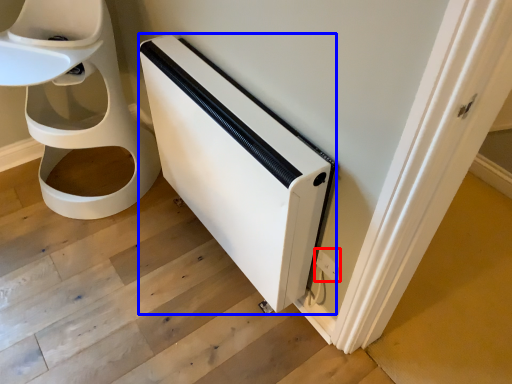
Question: Which of the following is the closest to the observer, electric outlet (highlighted by a red box) or appliance (highlighted by a blue box)?

Choices:
 (A) electric outlet
 (B) appliance

Answer: (B)